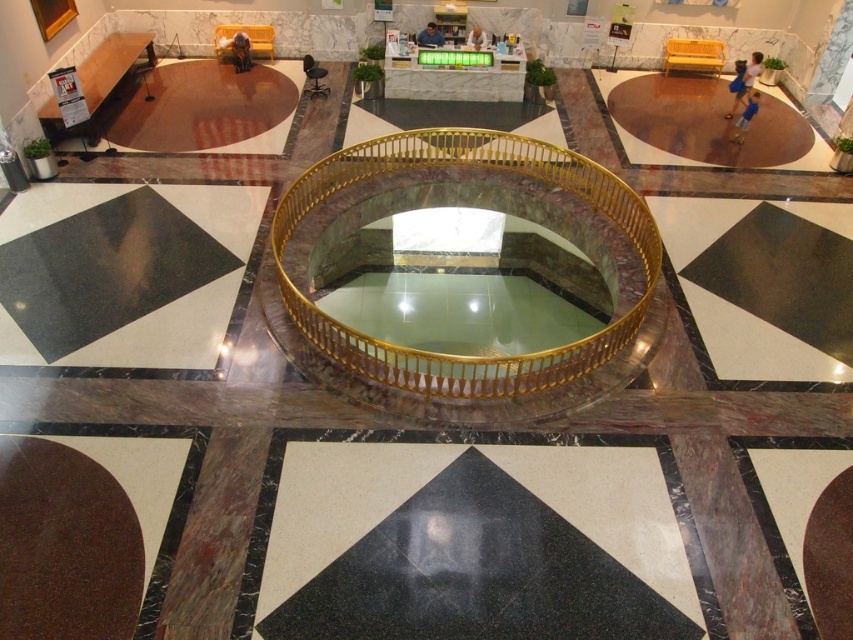
You are a maintenance worker needing to place a 2 meter wide equipment on the floor. The equipment must be placed entirely on either the black marble floor at lower right or the brown polished stone circle at lower left. Which area can accommodate the equipment?

The black marble floor at lower right might be wider than brown polished stone circle at lower left, so it is possible that the black marble floor at lower right can accommodate the 2 meter wide equipment. However, since the width comparison is uncertain, further measurement is needed to confirm.

You are a maintenance worker needing to move a 3.5 meter long equipment from the black marble atrium at lower left to the black marble floor at lower right. Can you move it directly without rotating it?

The distance between the black marble atrium at lower left and the black marble floor at lower right is 7.26 meters. Since the equipment is 3.5 meters long, it can be moved directly without needing to rotate as the distance is sufficient.

You are a tour guide leading a group and want to move from the black marble floor at lower right to the brown polished stone circle at lower left. If your group moves at a speed of 1.5 meters per second, how many seconds will it take to reach the destination?

The distance between the black marble floor at lower right and the brown polished stone circle at lower left is 7.33 meters. At a speed of 1.5 meters per second, the time required is 7.33 divided by 1.5, which equals approximately 4.89 seconds. Therefore, it will take about 4.89 seconds to reach the destination.